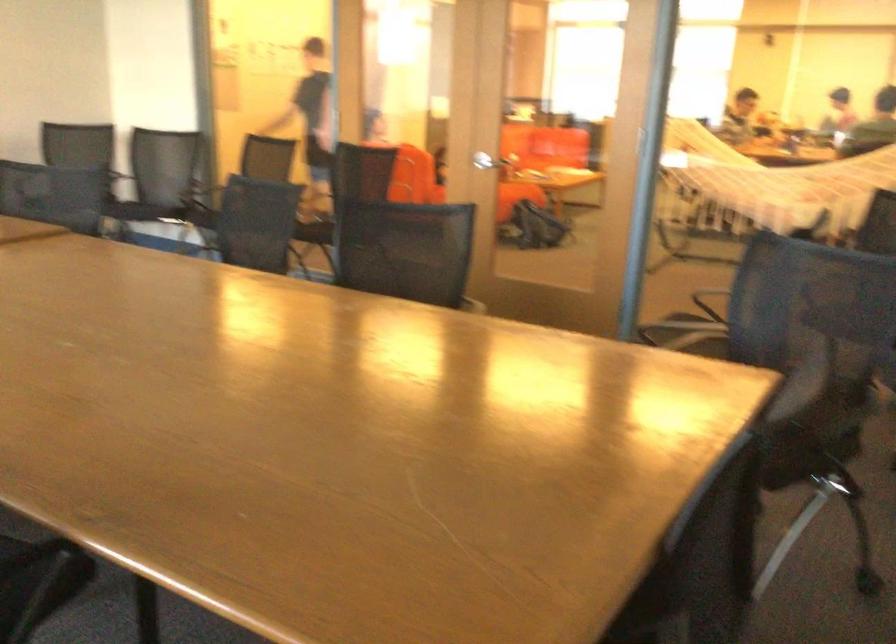
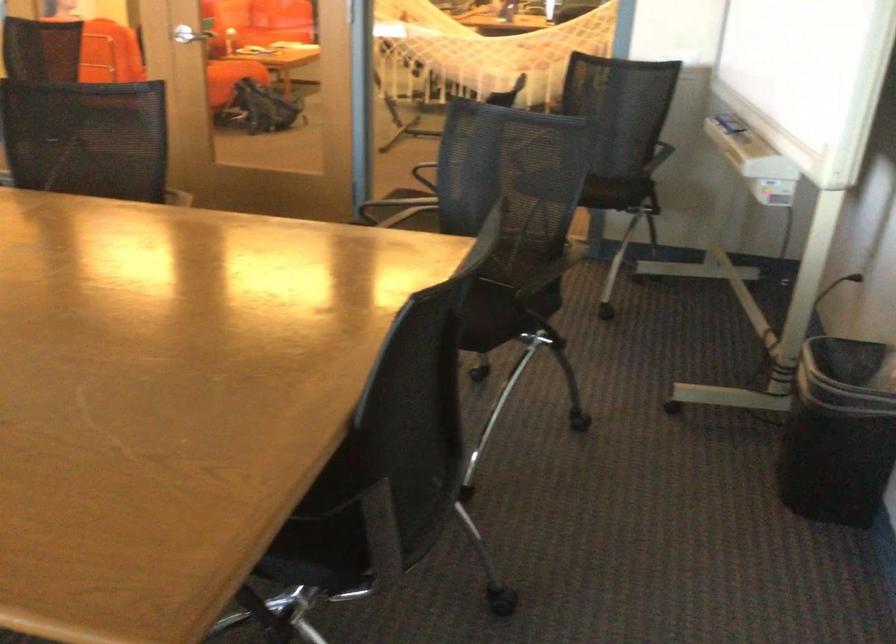
Question: Based on the continuous images, in which direction is the camera rotating? Reply with the corresponding letter.

Choices:
 (A) Left
 (B) Right
 (C) Up
 (D) Down

Answer: (B)